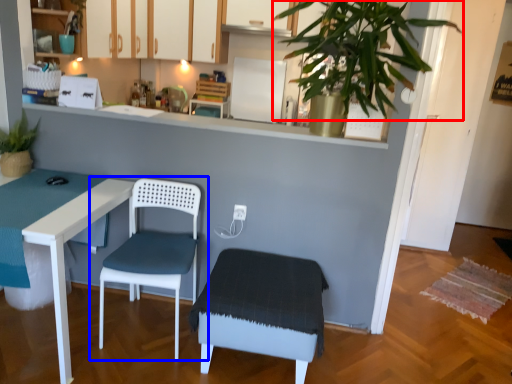
Question: Which object is further to the camera taking this photo, vegetation (highlighted by a red box) or chair (highlighted by a blue box)?

Choices:
 (A) vegetation
 (B) chair

Answer: (B)